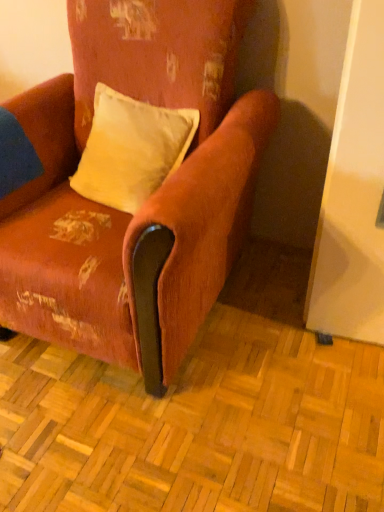
Question: From a real-world perspective, is velvet-like orange armchair at center physically located above or below velvet yellow pillow at center?

Choices:
 (A) above
 (B) below

Answer: (B)

Question: From the image's perspective, is velvet-like orange armchair at center positioned above or below velvet yellow pillow at center?

Choices:
 (A) below
 (B) above

Answer: (A)

Question: Is velvet-like orange armchair at center to the left or to the right of velvet yellow pillow at center in the image?

Choices:
 (A) left
 (B) right

Answer: (A)

Question: Is velvet yellow pillow at center wider or thinner than velvet-like orange armchair at center?

Choices:
 (A) wide
 (B) thin

Answer: (B)

Question: Considering their positions, is velvet yellow pillow at center located in front of or behind velvet-like orange armchair at center?

Choices:
 (A) behind
 (B) front

Answer: (A)

Question: Choose the correct answer: Is velvet yellow pillow at center inside velvet-like orange armchair at center or outside it?

Choices:
 (A) outside
 (B) inside

Answer: (B)

Question: Considering the positions of velvet yellow pillow at center and velvet-like orange armchair at center in the image, is velvet yellow pillow at center taller or shorter than velvet-like orange armchair at center?

Choices:
 (A) short
 (B) tall

Answer: (A)